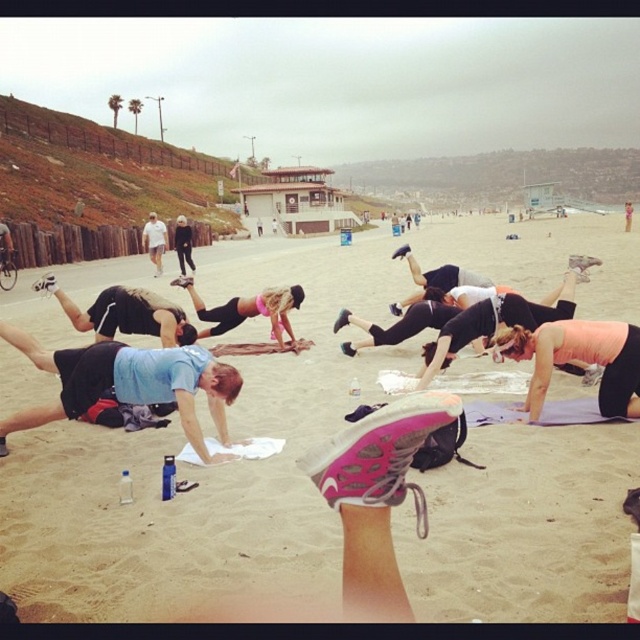
Based on the photo, can you confirm if pink matte yoga mat at lower right is thinner than blue fabric yoga mat at center?

Correct, pink matte yoga mat at lower right's width is less than blue fabric yoga mat at center's.

Is pink matte yoga mat at lower right above blue fabric yoga mat at center?

Incorrect, pink matte yoga mat at lower right is not positioned above blue fabric yoga mat at center.

Find the location of a particular element. This screenshot has width=640, height=640. pink matte yoga mat at lower right is located at coordinates (579, 358).

Is blue fabric shirt at center wider than pink matte yoga mat at lower right?

Indeed, blue fabric shirt at center has a greater width compared to pink matte yoga mat at lower right.

Does blue fabric shirt at center have a lesser width compared to pink matte yoga mat at lower right?

Incorrect, blue fabric shirt at center's width is not less than pink matte yoga mat at lower right's.

Which is behind, point (180, 397) or point (634, 353)?

Point (634, 353)

Where is `blue fabric shirt at center`? blue fabric shirt at center is located at coordinates (129, 384).

Measure the distance between beige sand at center and blue fabric shirt at center.

beige sand at center is 5.09 meters away from blue fabric shirt at center.

Image resolution: width=640 pixels, height=640 pixels. What are the coordinates of `beige sand at center` in the screenshot? It's located at (202, 467).

I want to click on beige sand at center, so click(x=202, y=467).

Image resolution: width=640 pixels, height=640 pixels. Identify the location of beige sand at center. (202, 467).